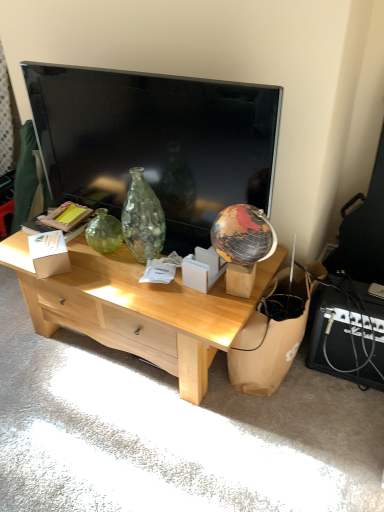
I want to click on free space in front of brown paper bag at lower right, so click(294, 431).